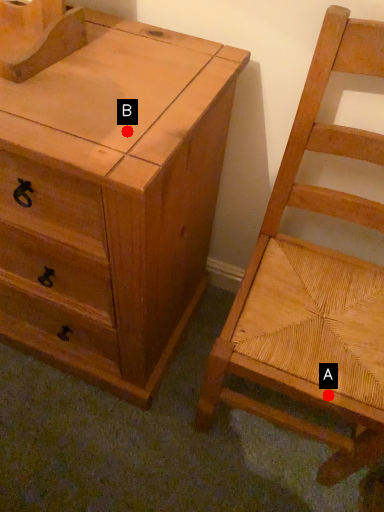
Question: Two points are circled on the image, labeled by A and B beside each circle. Which of the following is the farthest from the observer?

Choices:
 (A) A is further
 (B) B is further

Answer: (A)